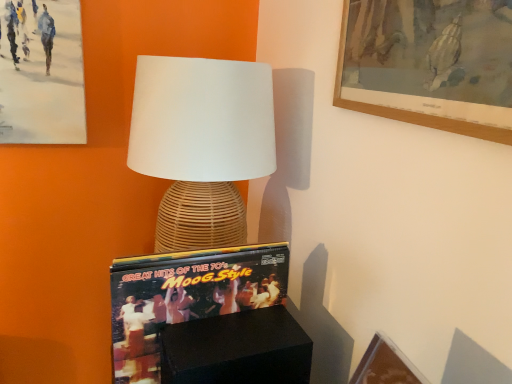
Question: Is matte vinyl record at center oriented towards black matte box at lower center?

Choices:
 (A) no
 (B) yes

Answer: (A)

Question: Considering the relative positions of matte vinyl record at center and black matte box at lower center in the image provided, is matte vinyl record at center to the left of black matte box at lower center from the viewer's perspective?

Choices:
 (A) no
 (B) yes

Answer: (B)

Question: From a real-world perspective, is matte vinyl record at center over black matte box at lower center?

Choices:
 (A) no
 (B) yes

Answer: (B)

Question: From the image's perspective, is matte vinyl record at center located beneath black matte box at lower center?

Choices:
 (A) yes
 (B) no

Answer: (B)

Question: Does matte vinyl record at center appear on the right side of black matte box at lower center?

Choices:
 (A) yes
 (B) no

Answer: (B)

Question: Is point (133, 360) closer or farther from the camera than point (303, 359)?

Choices:
 (A) closer
 (B) farther

Answer: (A)

Question: Considering the relative positions of matte vinyl record at center and black matte box at lower center in the image provided, is matte vinyl record at center to the left or to the right of black matte box at lower center?

Choices:
 (A) right
 (B) left

Answer: (B)

Question: Looking at the image, does matte vinyl record at center seem bigger or smaller compared to black matte box at lower center?

Choices:
 (A) big
 (B) small

Answer: (A)

Question: Is matte vinyl record at center wider or thinner than black matte box at lower center?

Choices:
 (A) thin
 (B) wide

Answer: (B)

Question: In the image, is woven rattan lamp at center on the left side or the right side of matte vinyl record at center?

Choices:
 (A) left
 (B) right

Answer: (A)

Question: From the image's perspective, relative to matte vinyl record at center, is woven rattan lamp at center above or below?

Choices:
 (A) below
 (B) above

Answer: (B)

Question: Considering the positions of woven rattan lamp at center and matte vinyl record at center in the image, is woven rattan lamp at center taller or shorter than matte vinyl record at center?

Choices:
 (A) short
 (B) tall

Answer: (B)

Question: Does point (238, 104) appear closer or farther from the camera than point (156, 289)?

Choices:
 (A) closer
 (B) farther

Answer: (B)

Question: From a real-world perspective, relative to black matte box at lower center, is woven rattan lamp at center vertically above or below?

Choices:
 (A) below
 (B) above

Answer: (B)

Question: Is woven rattan lamp at center in front of or behind black matte box at lower center in the image?

Choices:
 (A) front
 (B) behind

Answer: (B)